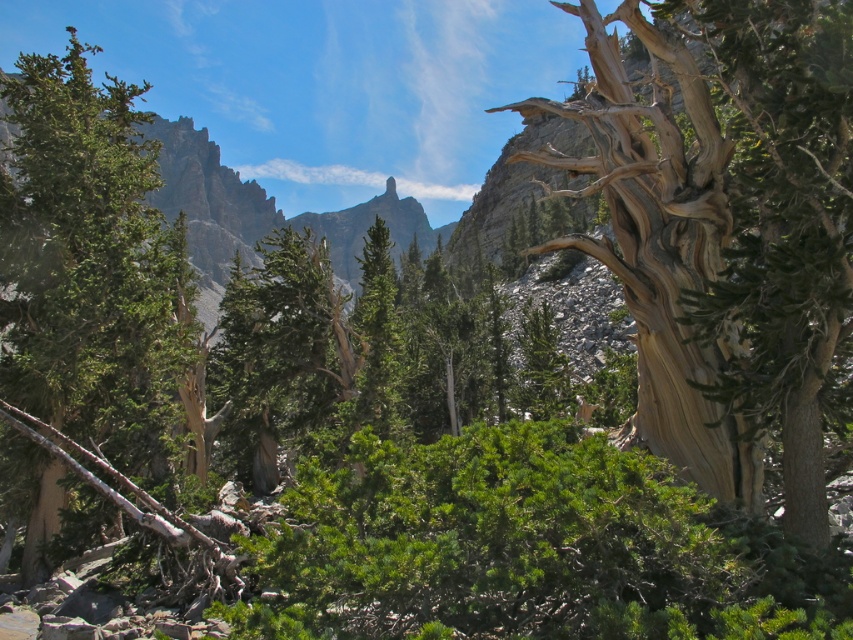
Question: Can you confirm if gray textured bark tree at center is positioned to the left of green rock at upper center?

Choices:
 (A) no
 (B) yes

Answer: (A)

Question: Which point is farther to the camera?

Choices:
 (A) (192, 124)
 (B) (749, 51)

Answer: (A)

Question: Among these points, which one is nearest to the camera?

Choices:
 (A) (173, 276)
 (B) (706, 35)

Answer: (B)

Question: In this image, where is gray textured bark tree at center located relative to green rough bark tree at left?

Choices:
 (A) right
 (B) left

Answer: (A)

Question: From the image, what is the correct spatial relationship of gray textured bark tree at center in relation to green rock at upper center?

Choices:
 (A) right
 (B) left

Answer: (A)

Question: Which point is farther from the camera taking this photo?

Choices:
 (A) pyautogui.click(x=167, y=404)
 (B) pyautogui.click(x=404, y=218)

Answer: (B)